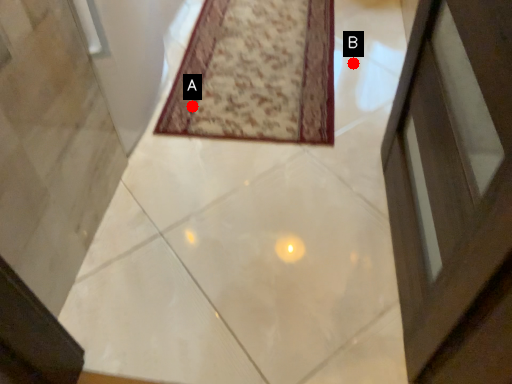
Question: Two points are circled on the image, labeled by A and B beside each circle. Which point appears farthest from the camera in this image?

Choices:
 (A) A is further
 (B) B is further

Answer: (B)